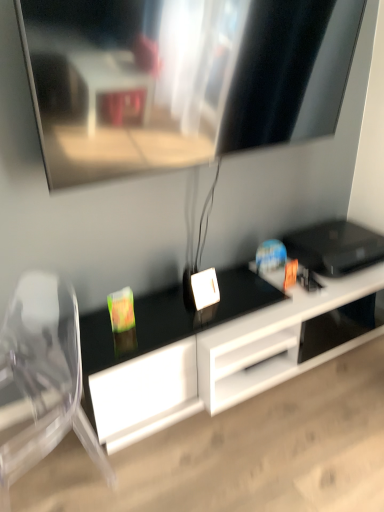
Question: Are transparent plastic swivel chair at left and black glossy desk at center beside each other?

Choices:
 (A) yes
 (B) no

Answer: (B)

Question: Does transparent plastic swivel chair at left have a lesser width compared to black glossy desk at center?

Choices:
 (A) yes
 (B) no

Answer: (A)

Question: From a real-world perspective, is transparent plastic swivel chair at left located beneath black glossy desk at center?

Choices:
 (A) no
 (B) yes

Answer: (A)

Question: Can you confirm if transparent plastic swivel chair at left is bigger than black glossy desk at center?

Choices:
 (A) yes
 (B) no

Answer: (B)

Question: Considering the relative sizes of transparent plastic swivel chair at left and black glossy desk at center in the image provided, is transparent plastic swivel chair at left taller than black glossy desk at center?

Choices:
 (A) yes
 (B) no

Answer: (A)

Question: Does transparent plastic swivel chair at left appear on the left side of black glossy desk at center?

Choices:
 (A) no
 (B) yes

Answer: (B)

Question: Is black glossy desk at center positioned before transparent plastic swivel chair at left?

Choices:
 (A) no
 (B) yes

Answer: (A)

Question: Would you say black glossy desk at center is a long distance from transparent plastic swivel chair at left?

Choices:
 (A) yes
 (B) no

Answer: (B)

Question: Does black glossy desk at center come behind transparent plastic swivel chair at left?

Choices:
 (A) no
 (B) yes

Answer: (B)

Question: Is black glossy desk at center oriented towards transparent plastic swivel chair at left?

Choices:
 (A) no
 (B) yes

Answer: (A)

Question: From a real-world perspective, is black glossy desk at center positioned under transparent plastic swivel chair at left based on gravity?

Choices:
 (A) no
 (B) yes

Answer: (B)

Question: Considering the relative positions of black glossy desk at center and transparent plastic swivel chair at left in the image provided, is black glossy desk at center to the right of transparent plastic swivel chair at left from the viewer's perspective?

Choices:
 (A) no
 (B) yes

Answer: (B)

Question: Is transparent plastic swivel chair at left situated inside black glossy desk at center or outside?

Choices:
 (A) inside
 (B) outside

Answer: (B)